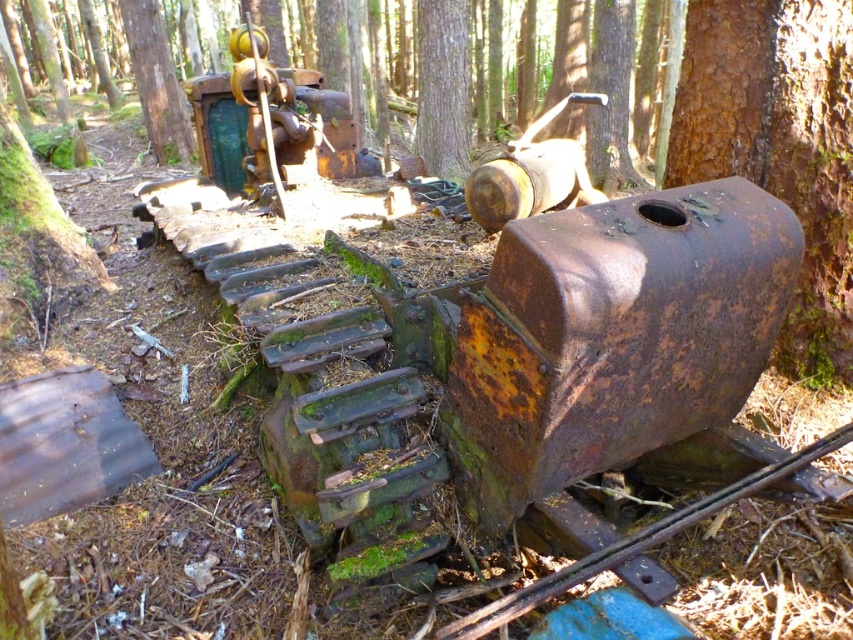
Does smooth brown tree trunk at center have a greater width compared to green mossy tree at upper center?

Yes, smooth brown tree trunk at center is wider than green mossy tree at upper center.

Which is more to the left, smooth brown tree trunk at center or green mossy tree at upper center?

green mossy tree at upper center is more to the left.

Between point (439, 42) and point (165, 163), which one is positioned behind?

Point (165, 163)

Locate an element on the screen. The height and width of the screenshot is (640, 853). smooth brown tree trunk at center is located at coordinates (444, 88).